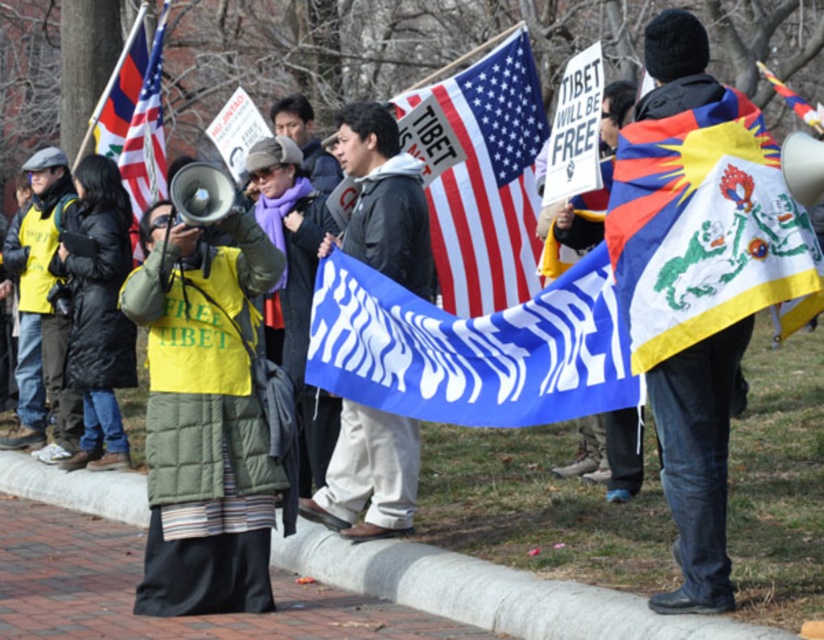
Question: Among these points, which one is nearest to the camera?

Choices:
 (A) (741, 316)
 (B) (378, 474)
 (C) (616, 396)

Answer: (A)

Question: Is american flag at center to the left of white matte flag at center from the viewer's perspective?

Choices:
 (A) no
 (B) yes

Answer: (A)

Question: Which is farther from the matte black flag at upper left?

Choices:
 (A) embroidered silk flag at upper right
 (B) gray concrete curb at lower center
 (C) yellow fabric vest at left

Answer: (A)

Question: Does blue fabric flag at center appear on the left side of american flag at center?

Choices:
 (A) no
 (B) yes

Answer: (B)

Question: Which of the following is the farthest from the observer?

Choices:
 (A) yellow fabric vest at left
 (B) blue fabric flag at center

Answer: (A)

Question: From the image, what is the correct spatial relationship of gray concrete curb at lower center in relation to embroidered silk flag at upper right?

Choices:
 (A) left
 (B) right

Answer: (A)